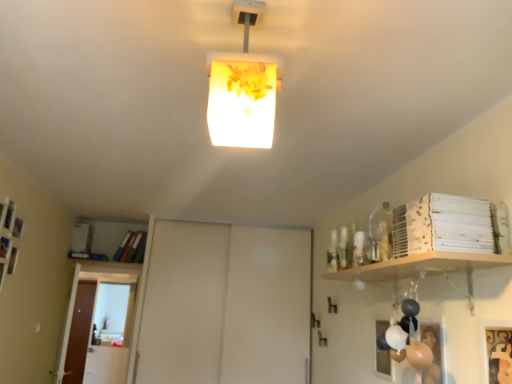
Question: Can we say white matte sliding door at center, which is the first door from right to left, lies outside translucent floral-patterned lampshade at center?

Choices:
 (A) no
 (B) yes

Answer: (B)

Question: Is white matte sliding door at center, which is the first door from right to left, oriented away from translucent floral-patterned lampshade at center?

Choices:
 (A) yes
 (B) no

Answer: (B)

Question: Is white matte sliding door at center, marked as the second door in a back-to-front arrangement, wider than translucent floral-patterned lampshade at center?

Choices:
 (A) yes
 (B) no

Answer: (A)

Question: From the image's perspective, is white matte sliding door at center, arranged as the first door when viewed from the front, under translucent floral-patterned lampshade at center?

Choices:
 (A) no
 (B) yes

Answer: (B)

Question: Considering the relative sizes of white matte sliding door at center, which is the first door from right to left, and translucent floral-patterned lampshade at center in the image provided, is white matte sliding door at center, which is the first door from right to left, smaller than translucent floral-patterned lampshade at center?

Choices:
 (A) yes
 (B) no

Answer: (B)

Question: From the image's perspective, is gold textured picture frame at lower right located above or below transparent glass door at lower left?

Choices:
 (A) above
 (B) below

Answer: (A)

Question: Looking at the image, does gold textured picture frame at lower right seem bigger or smaller compared to transparent glass door at lower left?

Choices:
 (A) small
 (B) big

Answer: (A)

Question: Is gold textured picture frame at lower right wider or thinner than transparent glass door at lower left?

Choices:
 (A) thin
 (B) wide

Answer: (A)

Question: From a real-world perspective, is gold textured picture frame at lower right physically located above or below transparent glass door at lower left?

Choices:
 (A) below
 (B) above

Answer: (B)

Question: Is point (117, 324) positioned closer to the camera than point (86, 301)?

Choices:
 (A) farther
 (B) closer

Answer: (A)

Question: Is transparent glass door at lower left inside or outside of brown wooden door at left, the first door viewed from the left?

Choices:
 (A) outside
 (B) inside

Answer: (A)

Question: Is transparent glass door at lower left wider or thinner than brown wooden door at left, the first door in the back-to-front sequence?

Choices:
 (A) wide
 (B) thin

Answer: (A)

Question: Is transparent glass door at lower left in front of or behind brown wooden door at left, the 2th door positioned from the right, in the image?

Choices:
 (A) front
 (B) behind

Answer: (A)

Question: Considering the positions of translucent floral-patterned lampshade at center and brown wooden door at left, the second door positioned from the front, in the image, is translucent floral-patterned lampshade at center bigger or smaller than brown wooden door at left, the second door positioned from the front,?

Choices:
 (A) small
 (B) big

Answer: (A)

Question: Is translucent floral-patterned lampshade at center taller or shorter than brown wooden door at left, the first door viewed from the left?

Choices:
 (A) tall
 (B) short

Answer: (B)